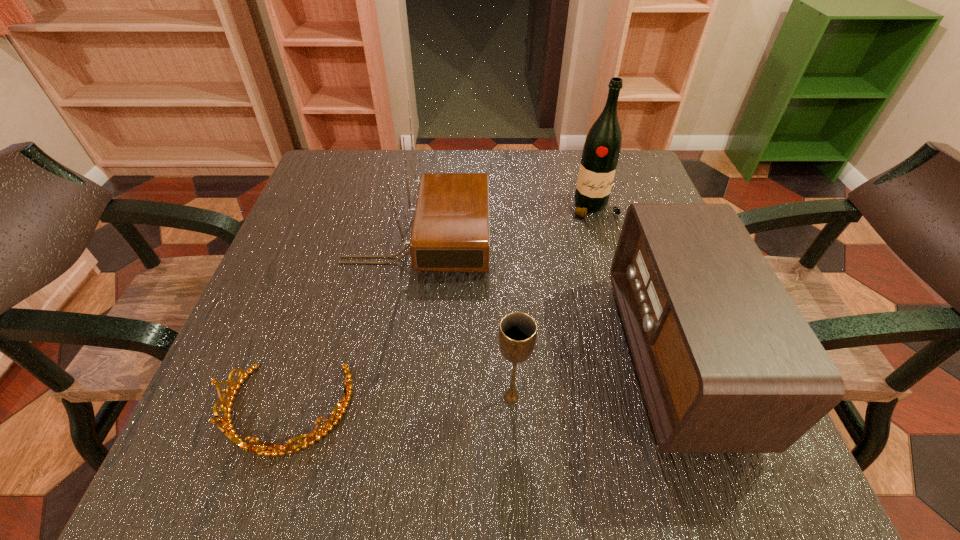
Find the location of `vacant space that satisfies the following two spatial constraints: 1. on the front panel of the fourth shortest object; 2. on the right side of the third object from right to left`. vacant space that satisfies the following two spatial constraints: 1. on the front panel of the fourth shortest object; 2. on the right side of the third object from right to left is located at coordinates (395, 397).

Where is `blank space that satisfies the following two spatial constraints: 1. on the front panel of the chalice; 2. on the left side of the taller radio receiver`? blank space that satisfies the following two spatial constraints: 1. on the front panel of the chalice; 2. on the left side of the taller radio receiver is located at coordinates (395, 397).

You are a GUI agent. You are given a task and a screenshot of the screen. Output one action in this format:
    pyautogui.click(x=<x>, y=<y>)
    Task: Click on the free space that satisfies the following two spatial constraints: 1. on the front panel of the second tallest object; 2. on the front-facing side of the tiara
    The width and height of the screenshot is (960, 540).
    Given the screenshot: What is the action you would take?
    pyautogui.click(x=393, y=411)

The image size is (960, 540). In order to click on vacant region that satisfies the following two spatial constraints: 1. on the front panel of the third object from left to right; 2. on the right side of the second tallest object in this screenshot , I will do `click(395, 397)`.

Locate an element on the screen. This screenshot has height=540, width=960. free location that satisfies the following two spatial constraints: 1. on the front-facing side of the shorter radio receiver; 2. on the front-facing side of the tiara is located at coordinates (696, 411).